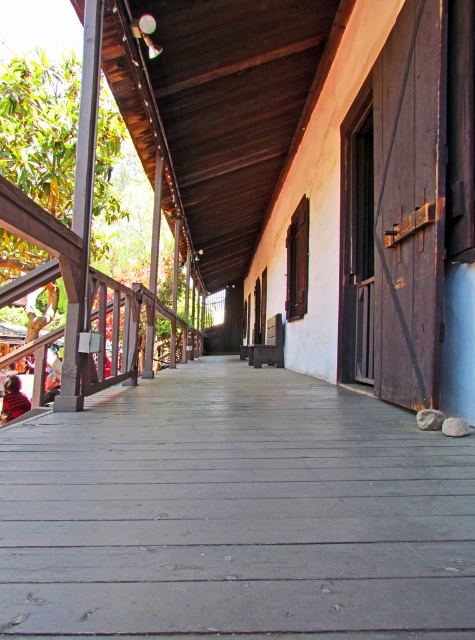
You are standing at the starting point of the walkway and want to reach the end. There are two points marked on the walkway, point (245, 564) and point (7, 412). Which point should you pass first while moving towards the end?

You should pass point (7, 412) first because point (245, 564) is in front of point (7, 412), meaning that point (7, 412) comes before it along the walkway.